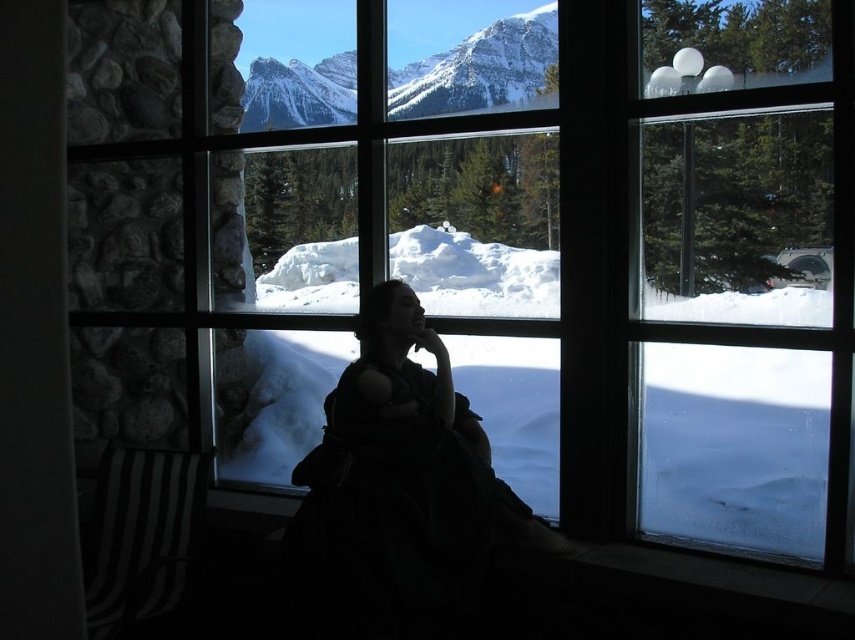
You are standing in the room and want to look outside through the transparent glass window at center and the transparent glass window at upper right. Which window should you approach if you want to see the snow on the mountains first?

The transparent glass window at center is to the left of the transparent glass window at upper right. Since the mountains are in the snowy landscape framed by the window, approaching the transparent glass window at center first would allow you to see the snow on the mountains as it is positioned to the left side of the upper right window.

You are an interior designer planning to place a large painting on the wall. The painting is the same size as the transparent glass window at center. Will the painting also cover part of the snowy granite mountains at upper left?

The transparent glass window at center is bigger than snowy granite mountains at upper left, so placing a painting the same size as the transparent glass window at center would indeed cover part of the snowy granite mountains at upper left.

You are standing in the room looking at the snowy mountains through the window. There are two points marked on the window glass at coordinates point (758, 413) and point (762, 412). Which point is closer to your face?

Point (758, 413) is further to the viewer than point (762, 412), so the point closer to your face is point (762, 412).